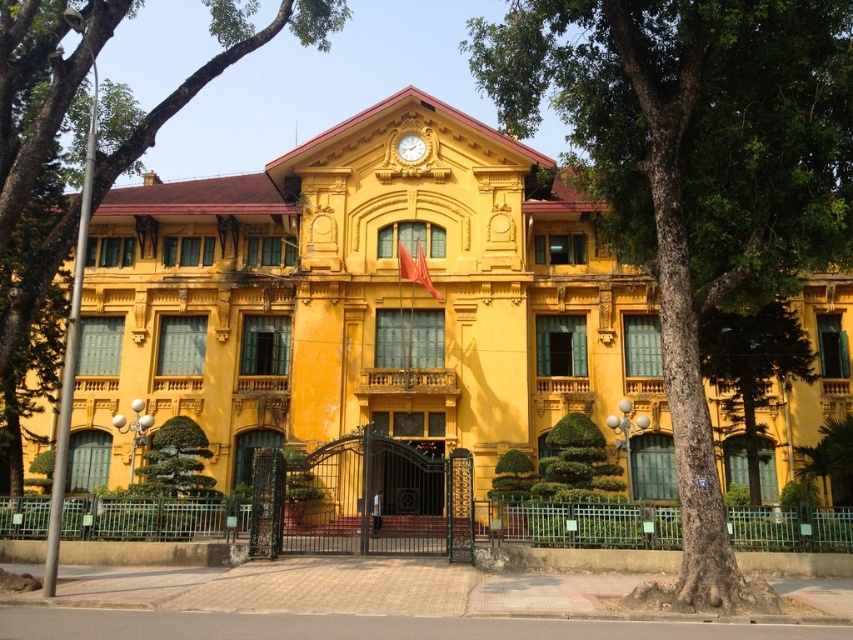
You are standing in front of the grand yellow building and want to take a photo of the gold textured clock at center. However, there is a green textured tree at lower right in the scene. Will the tree block your view of the clock?

The green textured tree at lower right is closer to the viewer than the gold textured clock at center, so it may block the view of the clock depending on the angle and distance from the tree. To ensure the clock is visible, move further away or adjust your position to avoid the tree obstructing the view.

You are a painter who wants to paint both the yellow matte building at center and the gold textured clock at center. If you have a limited amount of paint, which object should you prioritize painting first based on their sizes?

The yellow matte building at center should be prioritized first because its width is larger than the gold textured clock at center, requiring more paint.